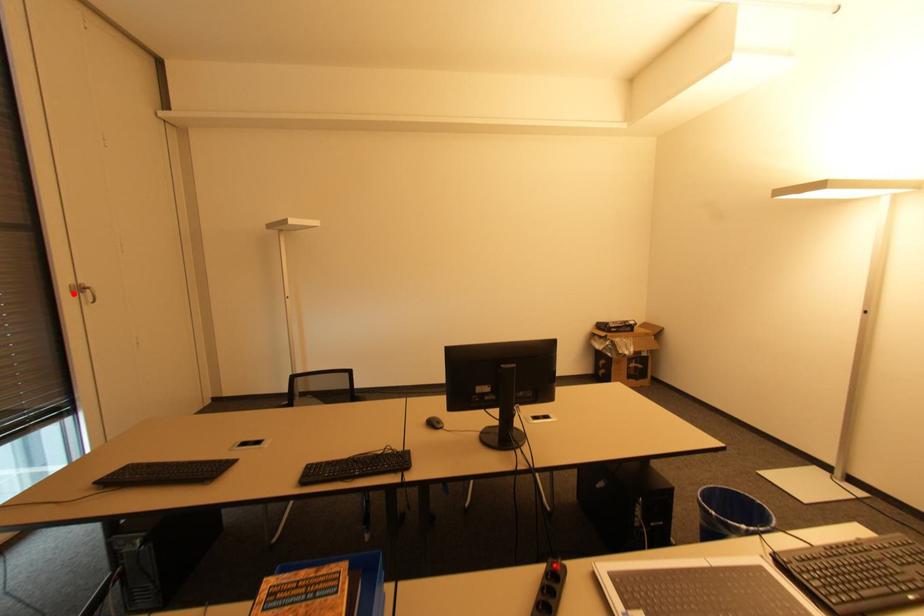
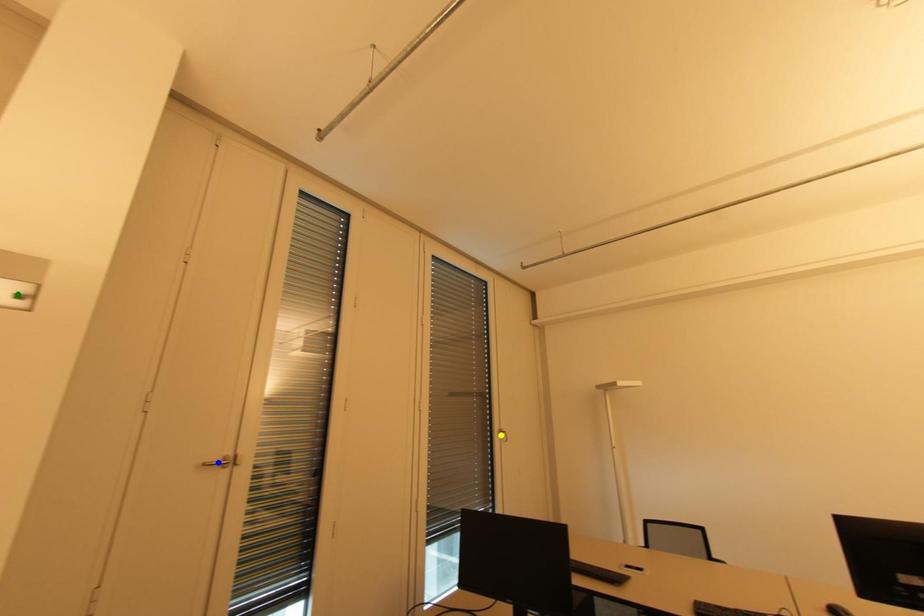
Question: I am providing you with two images of the same scene from different viewpoints. A red point is marked on the first image. You are given multiple points on the second image. Which point in image 2 is actually the same real-world point as the red point in image 1?

Choices:
 (A) blue point
 (B) green point
 (C) yellow point

Answer: (C)